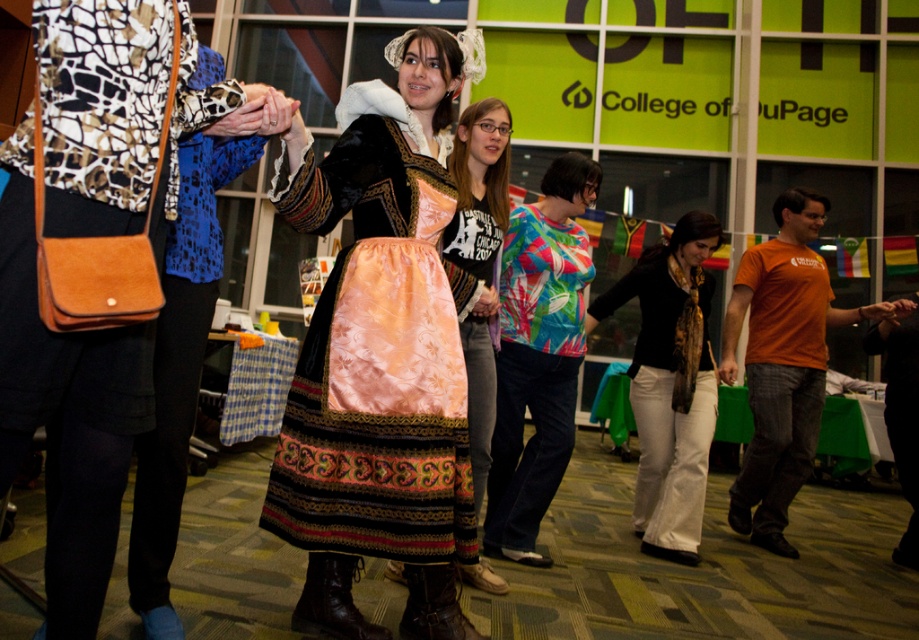
You are organizing a small event and need to place both the matte black purse at left and the black silk scarf at center on a narrow shelf. Based on their sizes, which item should you place first to ensure both fit?

The matte black purse at left should be placed first since it occupies less space than the black silk scarf at center, allowing both items to fit on the narrow shelf.

You are attending a cultural event and need to place a matte black purse at left and a black silk scarf at center into a small storage compartment. Which item should you place first to ensure both fit?

The matte black purse at left is shorter than the black silk scarf at center, so you should place the shorter matte black purse at left first to allow the longer black silk scarf at center to fit on top.